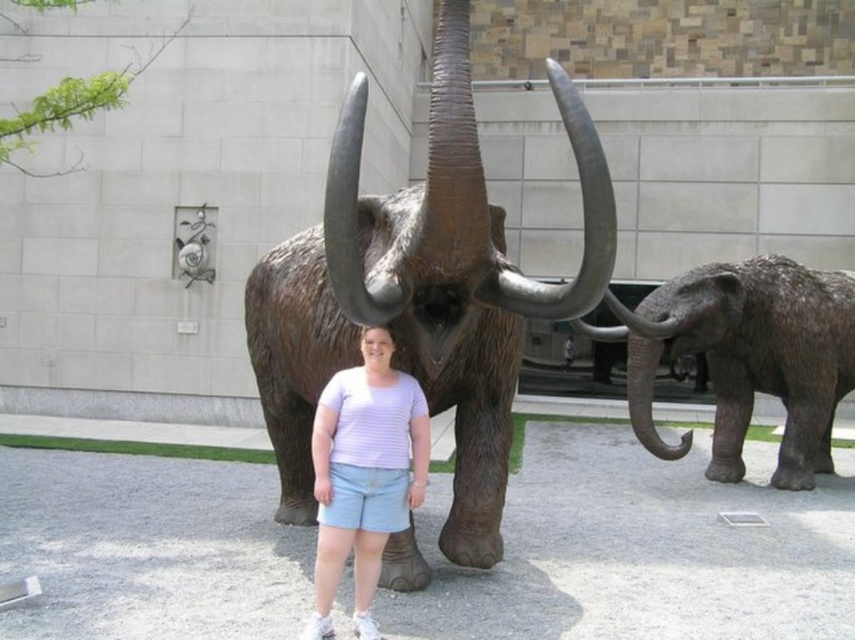
You are a tour guide explaining the statues in the museum courtyard. You have a group of visitors who are curious about the size relationship between the bronze statue of mammoth at center and the rough textured gray elephant at right. How would you describe their sizes to the group?

The bronze statue of mammoth at center is smaller in size compared to the rough textured gray elephant at right.

You are standing in a museum courtyard and see a point at coordinates (x=747, y=356). What object does this point correspond to?

The point at coordinates (x=747, y=356) corresponds to the rough textured gray elephant at right.